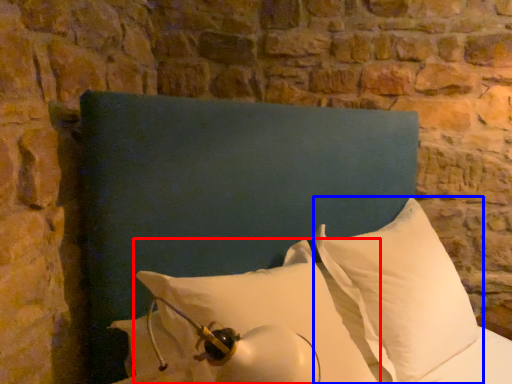
Question: Among these objects, which one is farthest to the camera, pillow (highlighted by a red box) or pillow (highlighted by a blue box)?

Choices:
 (A) pillow
 (B) pillow

Answer: (B)